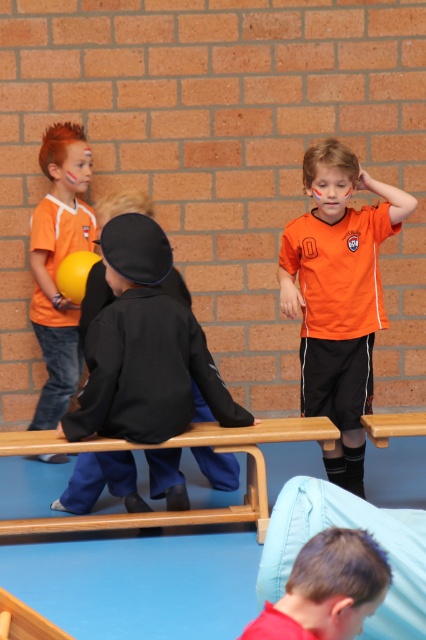
You are a photographer setting up for a sports event. You need to ensure that both the orange matte jersey at center and the matte orange shirt at left are fully visible in your photo. Based on their heights, which one might require you to adjust your camera angle to avoid being cut off?

The orange matte jersey at center is not as tall as the matte orange shirt at left, so the taller matte orange shirt at left might require adjusting the camera angle to ensure it isn